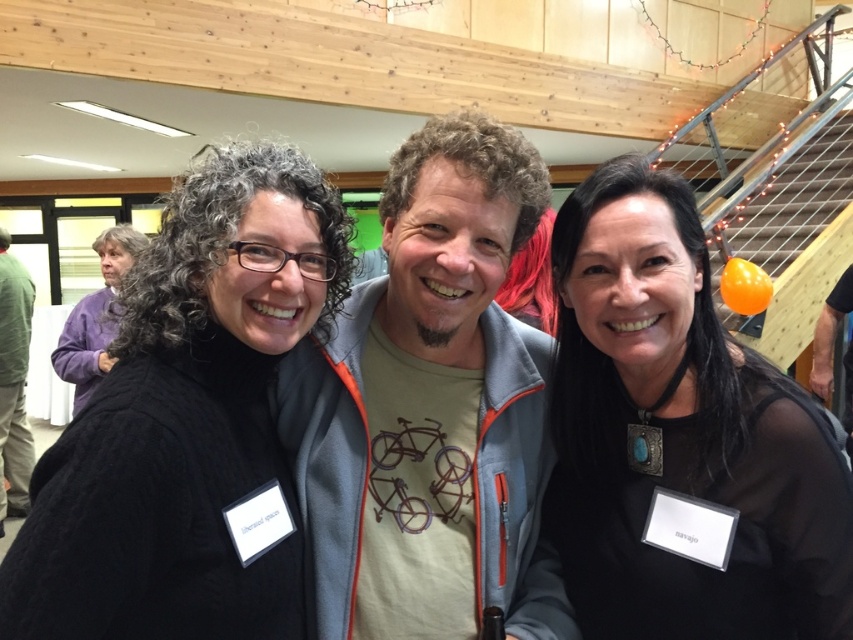
Between matte gray jacket at center and green cotton shirt at left, which one is positioned higher?

Positioned higher is matte gray jacket at center.

Image resolution: width=853 pixels, height=640 pixels. I want to click on matte gray jacket at center, so click(x=430, y=408).

The image size is (853, 640). What are the coordinates of `matte gray jacket at center` in the screenshot? It's located at (430, 408).

Is matte gray jacket at center taller than black mesh top at right?

Correct, matte gray jacket at center is much taller as black mesh top at right.

Find the location of `matte gray jacket at center`. matte gray jacket at center is located at coordinates (430, 408).

Find the location of a particular element. Image resolution: width=853 pixels, height=640 pixels. black cable-knit sweater at center is located at coordinates (189, 422).

Is black cable-knit sweater at center positioned behind green cotton shirt at left?

That is False.

Locate an element on the screen. black cable-knit sweater at center is located at coordinates (189, 422).